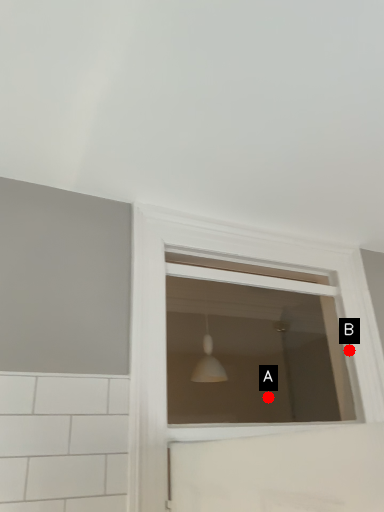
Question: Two points are circled on the image, labeled by A and B beside each circle. Among these points, which one is nearest to the camera?

Choices:
 (A) A is closer
 (B) B is closer

Answer: (B)